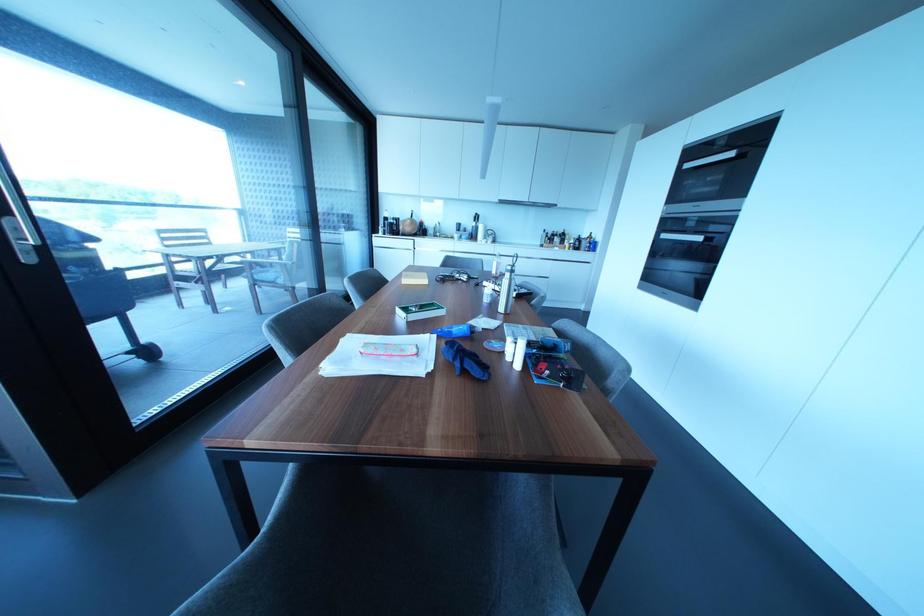
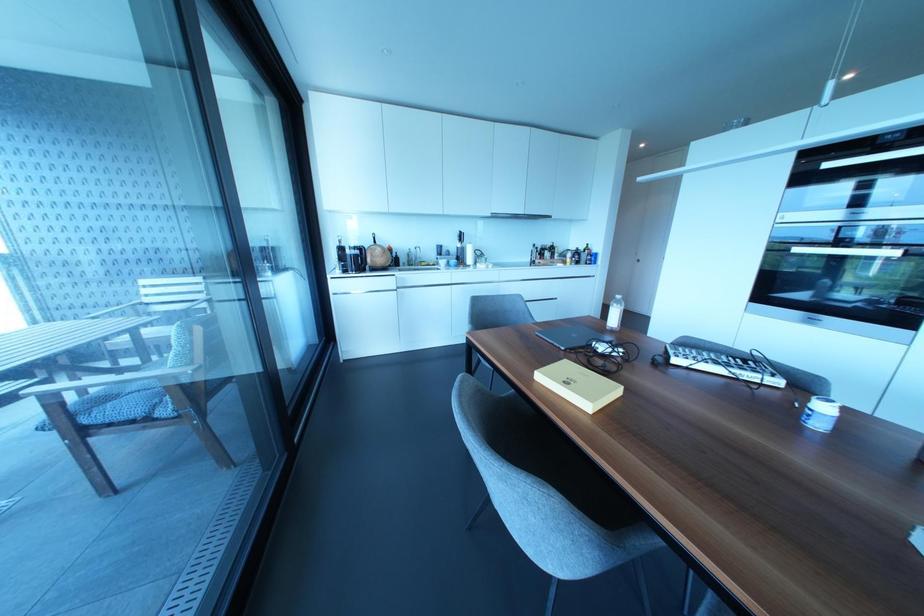
What movement of the cameraman would produce the second image?

The cameraman moved toward left, forward.